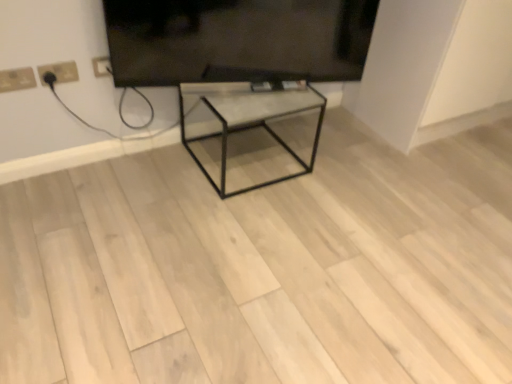
Question: From the image's perspective, is white plastic electric outlet at upper left, which appears as the 1th electric outlet when viewed from the left, located above or below metallic glass table at center?

Choices:
 (A) below
 (B) above

Answer: (B)

Question: Is white plastic electric outlet at upper left, which appears as the 1th electric outlet when viewed from the left, inside or outside of metallic glass table at center?

Choices:
 (A) inside
 (B) outside

Answer: (B)

Question: Which is nearer to the metallic glass table at center?

Choices:
 (A) black glossy tv at upper center
 (B) white plastic socket at upper left, positioned as the second electric outlet in left-to-right order
 (C) white plastic electric outlet at upper left, which appears as the 1th electric outlet when viewed from the left

Answer: (A)

Question: Based on their relative distances, which object is nearer to the white plastic socket at upper left, positioned as the second electric outlet in left-to-right order?

Choices:
 (A) black glossy tv at upper center
 (B) white plastic electric outlet at upper left, which appears as the 1th electric outlet when viewed from the left
 (C) metallic glass table at center

Answer: (B)